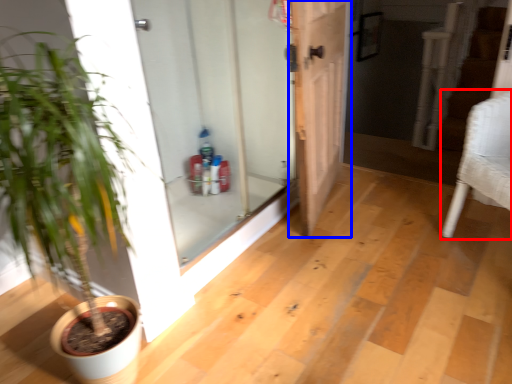
Question: Which point is closer to the camera, armchair (highlighted by a red box) or door (highlighted by a blue box)?

Choices:
 (A) armchair
 (B) door

Answer: (A)